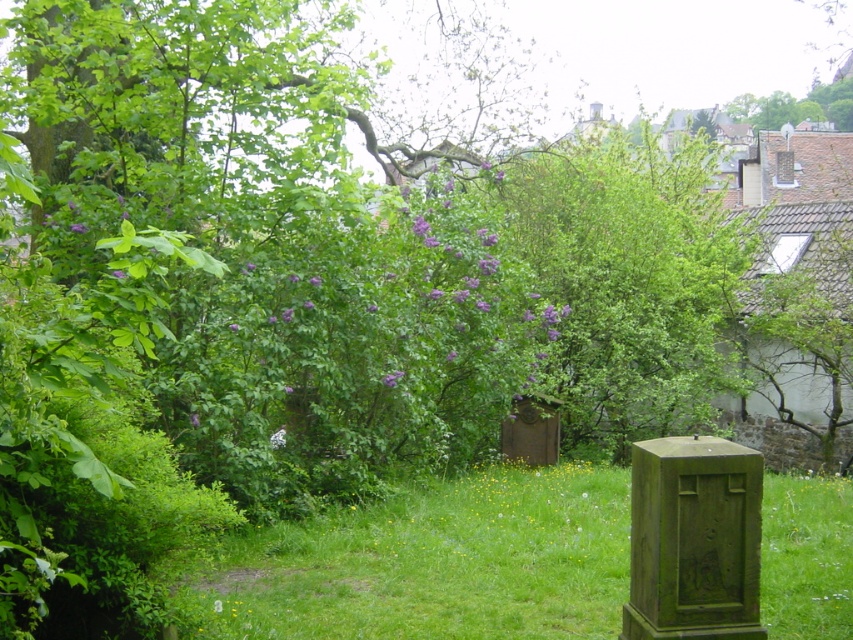
Question: Which of the following is the closest to the observer?

Choices:
 (A) (546, 566)
 (B) (634, 554)
 (C) (635, 157)

Answer: (B)

Question: Considering the real-world distances, which object is closest to the smooth stone gravestone at center?

Choices:
 (A) green grassy at center
 (B) green leafy tree at center

Answer: (B)

Question: Among these points, which one is nearest to the camera?

Choices:
 (A) (643, 209)
 (B) (761, 477)

Answer: (B)

Question: Is green leafy tree at center to the left of green mossy gravestone at lower right from the viewer's perspective?

Choices:
 (A) yes
 (B) no

Answer: (B)

Question: Can you confirm if green grassy at center is thinner than smooth stone gravestone at center?

Choices:
 (A) yes
 (B) no

Answer: (B)

Question: Is green mossy gravestone at lower right smaller than smooth stone gravestone at center?

Choices:
 (A) yes
 (B) no

Answer: (B)